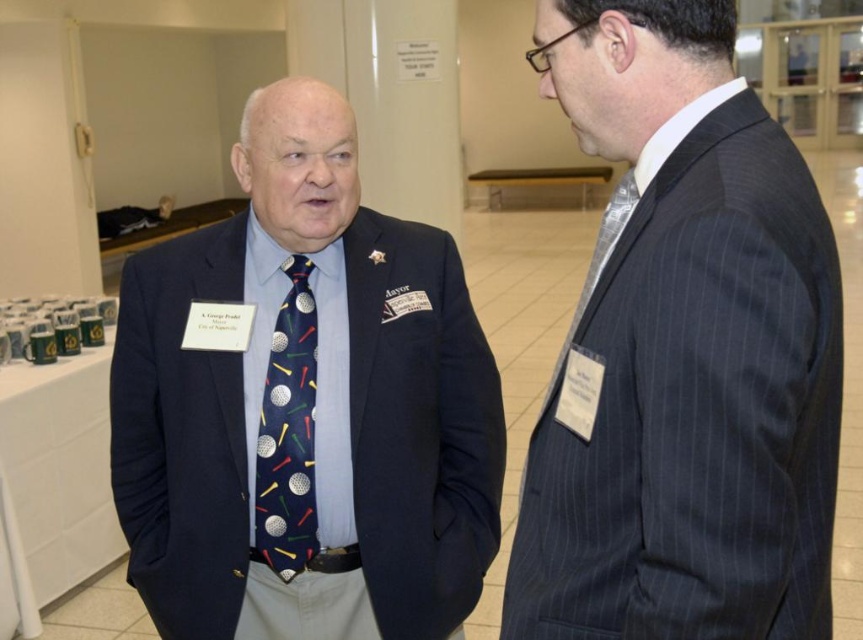
Question: Which of the following is the farthest from the observer?

Choices:
 (A) navy fabric tie at center
 (B) silvery metallic tie at right
 (C) dark pinstripe suit at right

Answer: (A)

Question: Which point is farther to the camera?

Choices:
 (A) tap(591, 262)
 (B) tap(316, 161)
 (C) tap(761, 104)
 (D) tap(257, 449)

Answer: (D)

Question: Where is navy blue suit at center located in relation to navy fabric tie at center in the image?

Choices:
 (A) below
 (B) above

Answer: (B)

Question: Does navy blue suit at center have a greater width compared to navy fabric tie at center?

Choices:
 (A) yes
 (B) no

Answer: (A)

Question: Is dark pinstripe suit at right thinner than silvery metallic tie at right?

Choices:
 (A) no
 (B) yes

Answer: (A)

Question: Among these points, which one is nearest to the camera?

Choices:
 (A) (281, 506)
 (B) (401, 625)

Answer: (A)